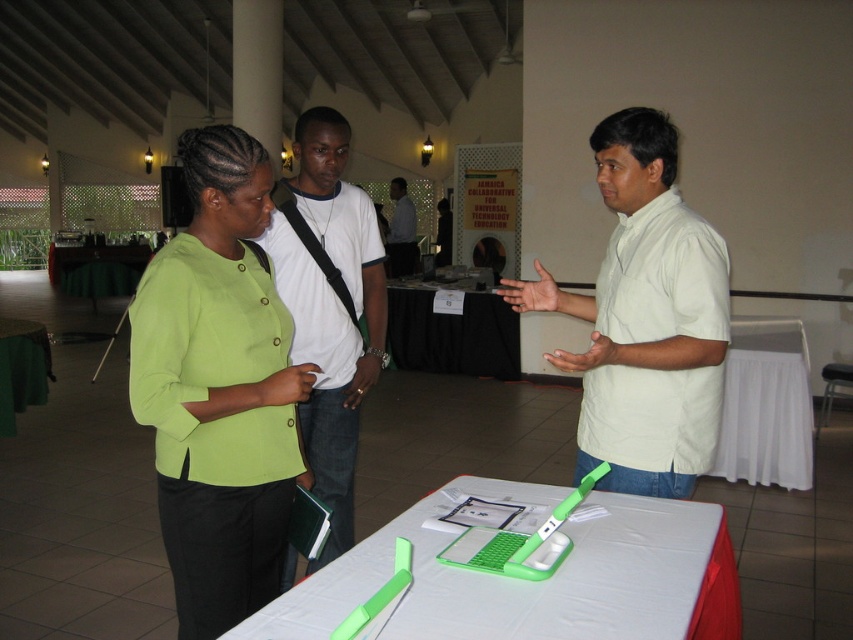
You are standing in the conference hall and want to locate the lime green fabric shirt at center. Based on the coordinates provided, where would you look to find it?

The lime green fabric shirt at center is located at the 2D coordinates point (219,388).

You are a guest at the event and need to place your green plastic laptop at center on a surface. Can you put it on the white cloth table at right?

The white cloth table at right is much taller than the green plastic laptop at center, so yes, you can place the green plastic laptop at center on the white cloth table at right since it is tall enough to accommodate it.

You are organizing a photo shoot in this conference hall. You have a lime green fabric shirt at center and a black fabric table at center. To ensure the shirt is visible in the photo, should you position the shirt closer to or farther from the camera than the table?

The lime green fabric shirt at center is already in front of the black fabric table at center, so positioning it closer to the camera would ensure visibility.